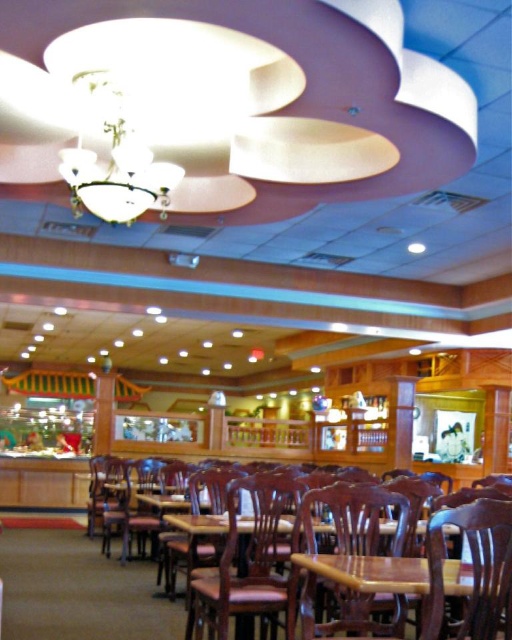
Does wooden chair at lower right have a greater width compared to wooden table at center?

No, wooden chair at lower right is not wider than wooden table at center.

Is point (438, 554) closer to camera compared to point (428, 586)?

That is True.

Find the location of `wooden chair at lower right`. wooden chair at lower right is located at coordinates (472, 566).

Where is `wooden chair at lower right`? Image resolution: width=512 pixels, height=640 pixels. wooden chair at lower right is located at coordinates (472, 566).

Is wooden chair at lower right further to the viewer compared to mahogany wood chair at center?

No.

Who is positioned more to the left, wooden chair at lower right or mahogany wood chair at center?

Positioned to the left is mahogany wood chair at center.

Who is more forward, (437, 592) or (267, 465)?

Point (437, 592) is in front.

What are the coordinates of `wooden chair at lower right` in the screenshot? It's located at (472, 566).

In the scene shown: Who is higher up, brown wood chair at center or wooden table at center?

wooden table at center

Is point (262, 593) farther from camera compared to point (349, 586)?

That is True.

Identify the location of brown wood chair at center. Image resolution: width=512 pixels, height=640 pixels. (248, 560).